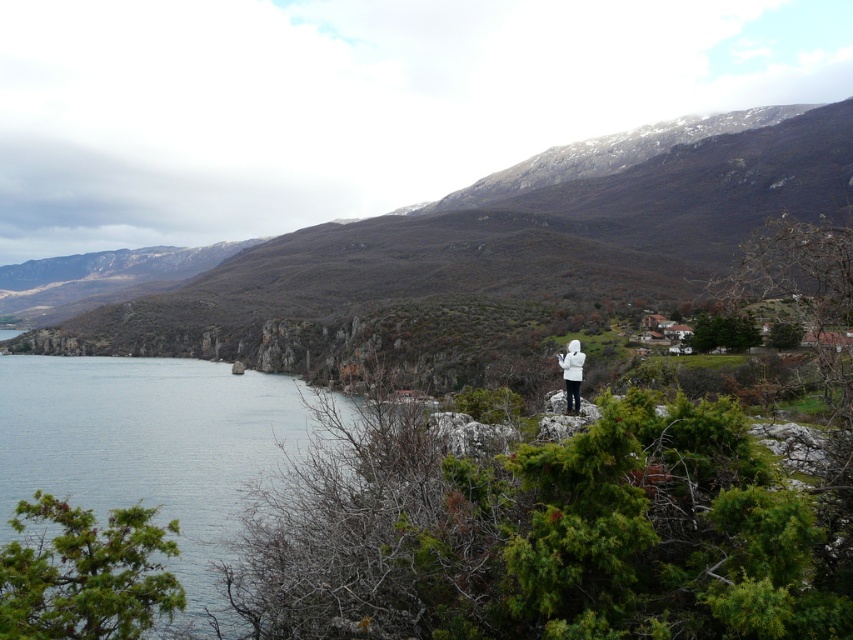
Question: Which point is farther from the camera taking this photo?

Choices:
 (A) (496, 200)
 (B) (120, 451)
 (C) (575, 378)

Answer: (A)

Question: Is rocky brown mountain at center bigger than white matte jacket at center?

Choices:
 (A) no
 (B) yes

Answer: (B)

Question: Can you confirm if rocky brown mountain at center is positioned to the left of blue water at lower left?

Choices:
 (A) no
 (B) yes

Answer: (A)

Question: Which object is closer to the camera taking this photo?

Choices:
 (A) rocky brown mountain at center
 (B) white matte jacket at center

Answer: (B)

Question: Can you confirm if blue water at lower left is smaller than white matte jacket at center?

Choices:
 (A) yes
 (B) no

Answer: (B)

Question: Which point is closer to the camera taking this photo?

Choices:
 (A) (231, 401)
 (B) (563, 365)
 (C) (732, 145)

Answer: (B)